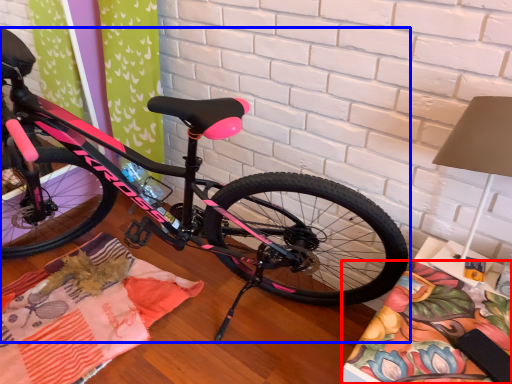
Question: Which object appears closest to the camera in this image, blanket (highlighted by a red box) or bicycle (highlighted by a blue box)?

Choices:
 (A) blanket
 (B) bicycle

Answer: (B)